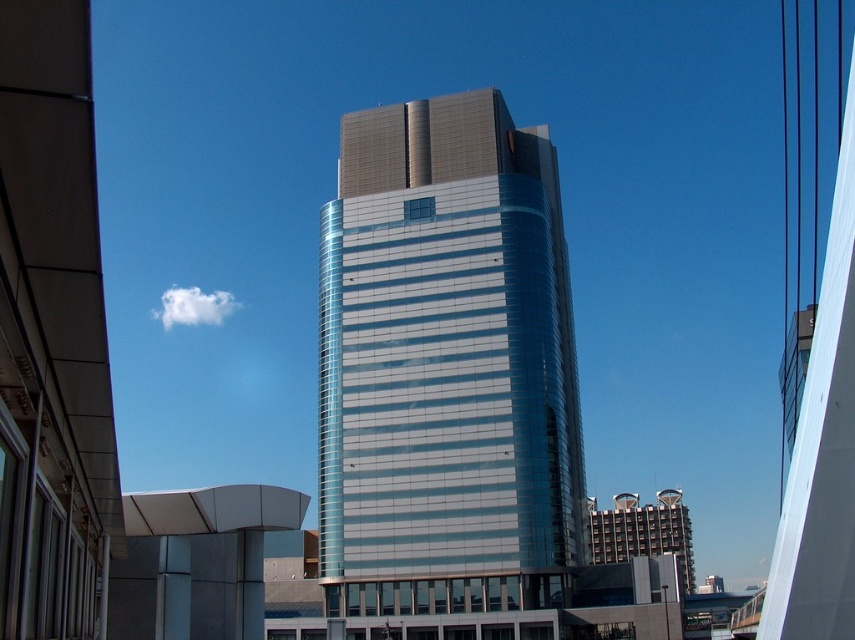
Question: Which object appears closest to the camera in this image?

Choices:
 (A) metallic silver building at lower right
 (B) shiny glass tower at center

Answer: (B)

Question: In this image, where is shiny glass tower at center located relative to metallic silver building at lower right?

Choices:
 (A) below
 (B) above

Answer: (B)

Question: Does shiny glass tower at center have a smaller size compared to metallic silver building at lower right?

Choices:
 (A) yes
 (B) no

Answer: (A)

Question: Is shiny glass tower at center positioned behind metallic silver building at lower right?

Choices:
 (A) yes
 (B) no

Answer: (B)